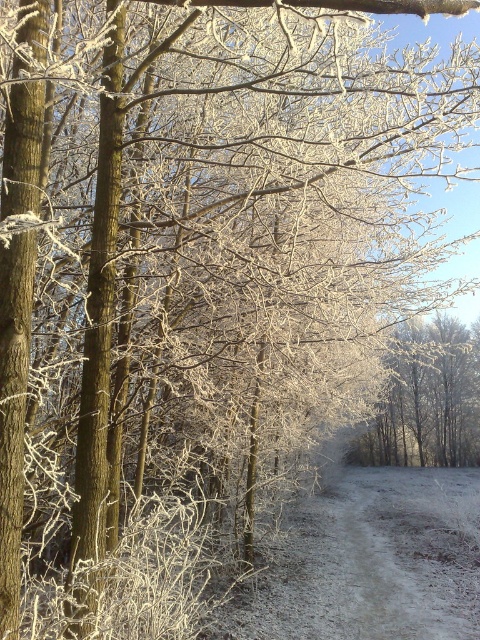
You are an explorer trying to navigate through the winter forest. You see a frosted dirt path at center and frosted branches at center. Which one is wider in width?

The frosted dirt path at center might be wider than frosted branches at center according to the description.

You are standing at the point closest to the camera in this winter forest scene. There are two points marked in the image, one at coordinates point (336, 577) and another at point (372, 428). Which point should you move towards if you want to walk towards the camera?

You should move towards point (336, 577) because it is closer to the camera than point (372, 428).